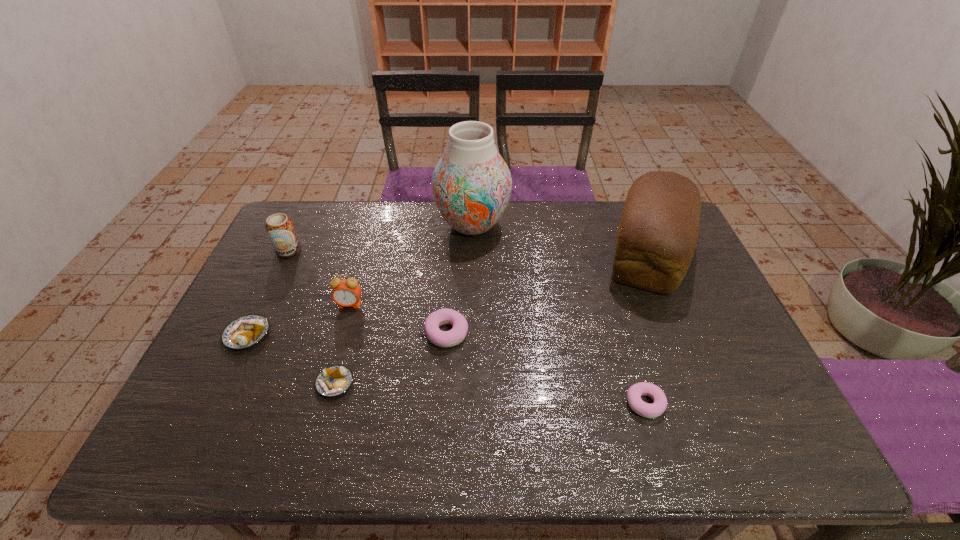
The height and width of the screenshot is (540, 960). What are the coordinates of `free space between the right brown pastry and the farther pink pastry` in the screenshot? It's located at (391, 358).

The width and height of the screenshot is (960, 540). I want to click on vacant space that is in between the tallest object and the third pastry from right to left, so click(404, 304).

Locate an element on the screen. The image size is (960, 540). object that can be found as the sixth closest to the left brown pastry is located at coordinates (634, 393).

You are a GUI agent. You are given a task and a screenshot of the screen. Output one action in this format:
    pyautogui.click(x=<x>, y=<y>)
    Task: Click on the seventh closest object to the nearer pink pastry
    The image size is (960, 540).
    Given the screenshot: What is the action you would take?
    pyautogui.click(x=279, y=227)

Where is `the third closest pastry relative to the nearer brown pastry`? This screenshot has width=960, height=540. the third closest pastry relative to the nearer brown pastry is located at coordinates (634, 393).

Where is `pastry identified as the third closest to the nearer pink pastry`? pastry identified as the third closest to the nearer pink pastry is located at coordinates pyautogui.click(x=246, y=331).

I want to click on free region that satisfies the following two spatial constraints: 1. on the face of the alarm clock; 2. on the right side of the bigger pink pastry, so click(342, 333).

Where is `vacant space that satisfies the following two spatial constraints: 1. on the front side of the smaller brown pastry; 2. on the right side of the left brown pastry`? vacant space that satisfies the following two spatial constraints: 1. on the front side of the smaller brown pastry; 2. on the right side of the left brown pastry is located at coordinates (224, 383).

I want to click on free space in the image that satisfies the following two spatial constraints: 1. on the face of the third pastry from right to left; 2. on the right side of the pink alarm clock, so click(x=327, y=383).